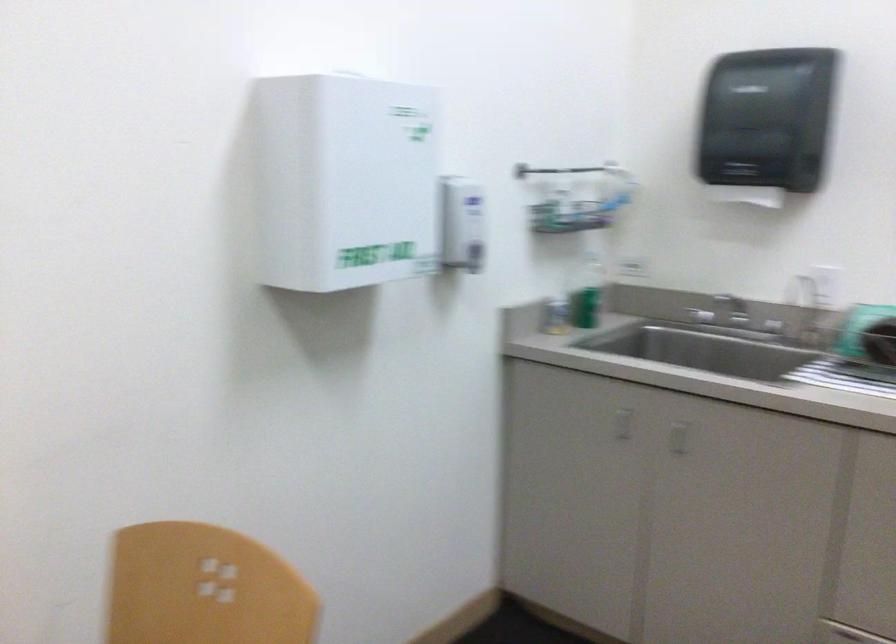
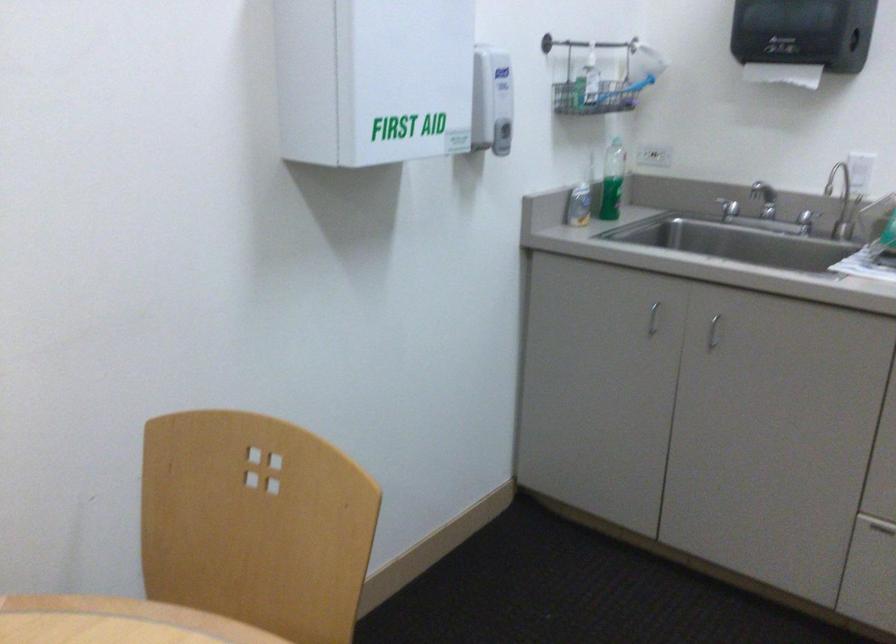
The point at (764,333) is marked in the first image. Where is the corresponding point in the second image?

(806, 221)